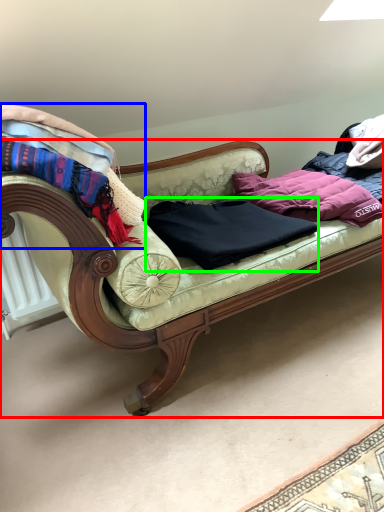
Question: Which object is the farthest from studio couch (highlighted by a red box)? Choose among these: blanket (highlighted by a blue box) or clothing (highlighted by a green box).

Choices:
 (A) blanket
 (B) clothing

Answer: (A)